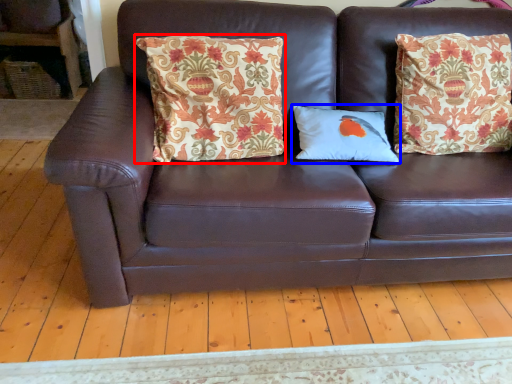
Question: Which point is closer to the camera, pillow (highlighted by a red box) or pillow (highlighted by a blue box)?

Choices:
 (A) pillow
 (B) pillow

Answer: (A)